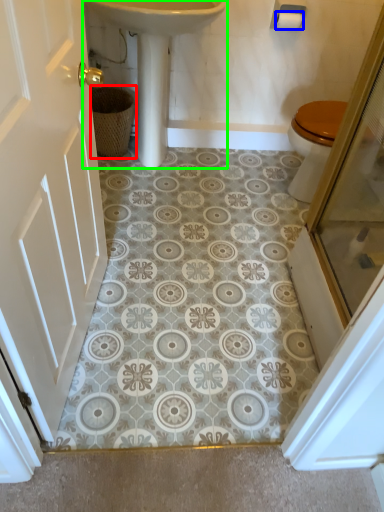
Question: Which is nearer to the basket (highlighted by a red box)? toilet paper (highlighted by a blue box) or sink (highlighted by a green box).

Choices:
 (A) toilet paper
 (B) sink

Answer: (B)